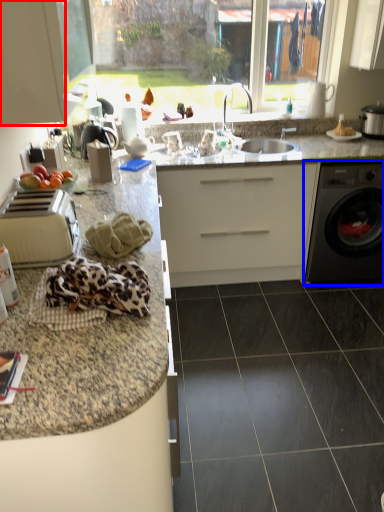
Question: Which of the following is the farthest to the observer, cabinetry (highlighted by a red box) or washing machine (highlighted by a blue box)?

Choices:
 (A) cabinetry
 (B) washing machine

Answer: (B)